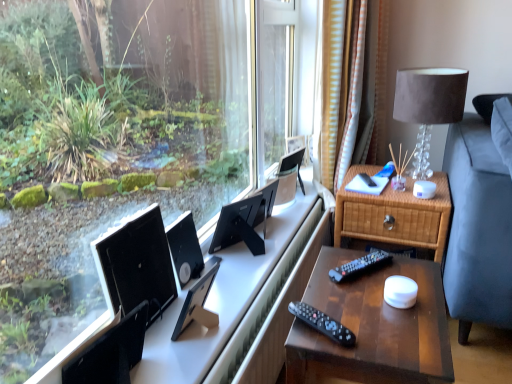
Question: From the image's perspective, is matte black monitor at center, marked as the 3th computer monitor in a back-to-front arrangement, located above or below black plastic remote control at lower center, the first remote control ordered from the bottom?

Choices:
 (A) above
 (B) below

Answer: (A)

Question: From their relative heights in the image, would you say matte black monitor at center, marked as the 3th computer monitor in a back-to-front arrangement, is taller or shorter than black plastic remote control at lower center, acting as the second remote control starting from the back?

Choices:
 (A) tall
 (B) short

Answer: (A)

Question: Estimate the real-world distances between objects in this image. Which object is closer to the matte black monitor at center, which appears as the second computer monitor when viewed from the front?

Choices:
 (A) black matte swivel chair at lower left
 (B) black matte computer monitor at center, arranged as the 1th computer monitor when viewed from the back
 (C) striped fabric curtain at right
 (D) satin brown lampshade at upper right
 (E) woven wood nightstand at right, marked as the 2th nightstand in a front-to-back arrangement

Answer: (B)

Question: Estimate the real-world distances between objects in this image. Which object is farther from the satin brown lampshade at upper right?

Choices:
 (A) black matte swivel chair at lower left
 (B) matte black monitor at center, which appears as the second computer monitor when viewed from the front
 (C) black matte computer monitor at center, arranged as the 2th computer monitor when viewed from the back
 (D) wooden nightstand at right, which is the second nightstand in back-to-front order
 (E) black plastic computer desk at center

Answer: (A)